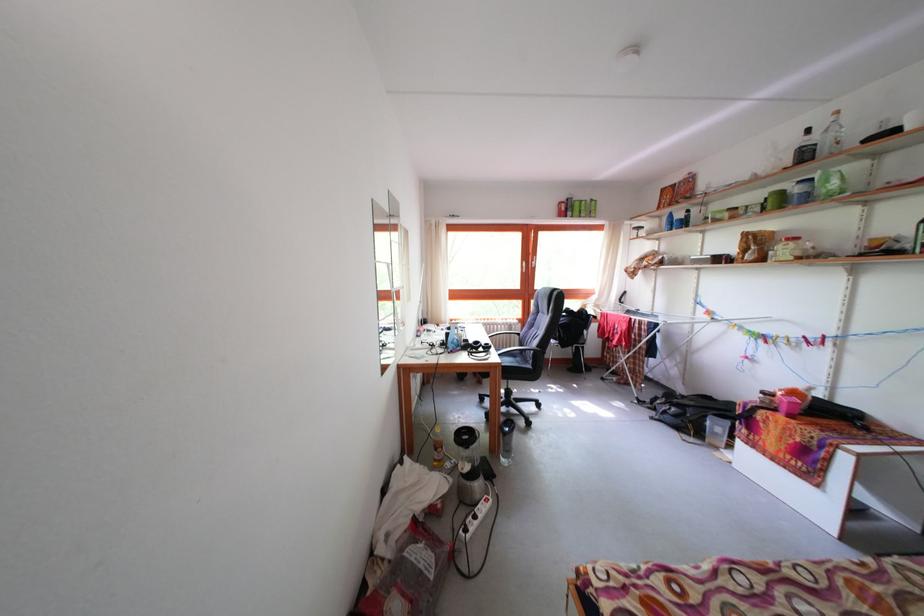
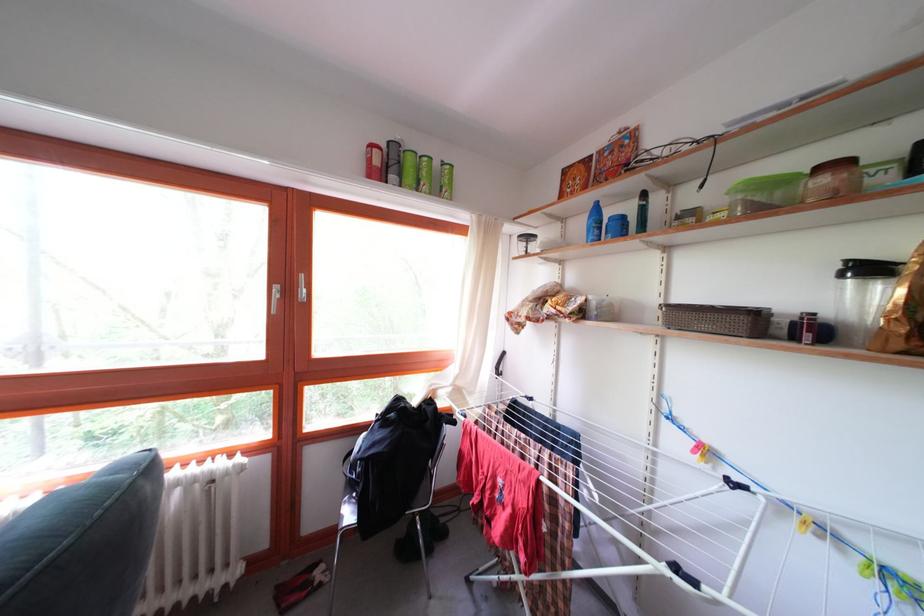
Where in the second image is the point corresponding to (x=736, y=221) from the first image?

(832, 187)